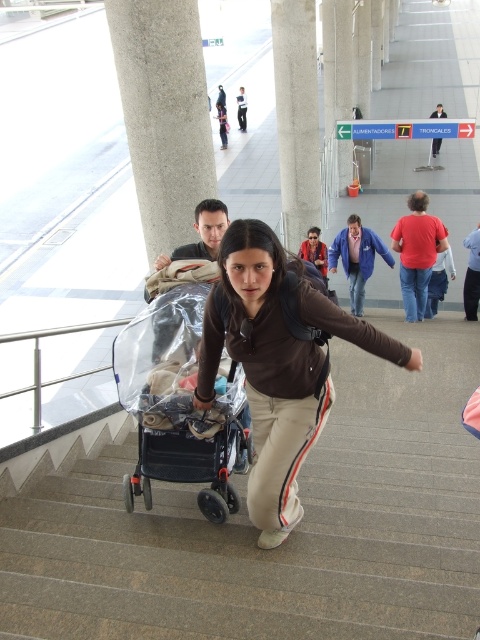
Does brown matte jacket at center appear on the left side of blue denim jacket at center?

Yes, brown matte jacket at center is to the left of blue denim jacket at center.

Is point (313, 360) closer to viewer compared to point (350, 262)?

Yes, it is in front of point (350, 262).

Where is `brown matte jacket at center`? This screenshot has width=480, height=640. brown matte jacket at center is located at coordinates (264, 372).

Is point (251, 518) positioned before point (439, 147)?

Yes, point (251, 518) is in front of point (439, 147).

The image size is (480, 640). Find the location of `brown matte jacket at center`. brown matte jacket at center is located at coordinates (264, 372).

Does blue denim jacket at center appear under white fabric shirt at center?

Indeed, blue denim jacket at center is positioned under white fabric shirt at center.

Is the position of blue denim jacket at center more distant than that of white fabric shirt at center?

No, blue denim jacket at center is in front of white fabric shirt at center.

Which is behind, point (332, 243) or point (431, 115)?

The point (431, 115) is behind.

Where is `blue denim jacket at center`? The image size is (480, 640). blue denim jacket at center is located at coordinates (357, 259).